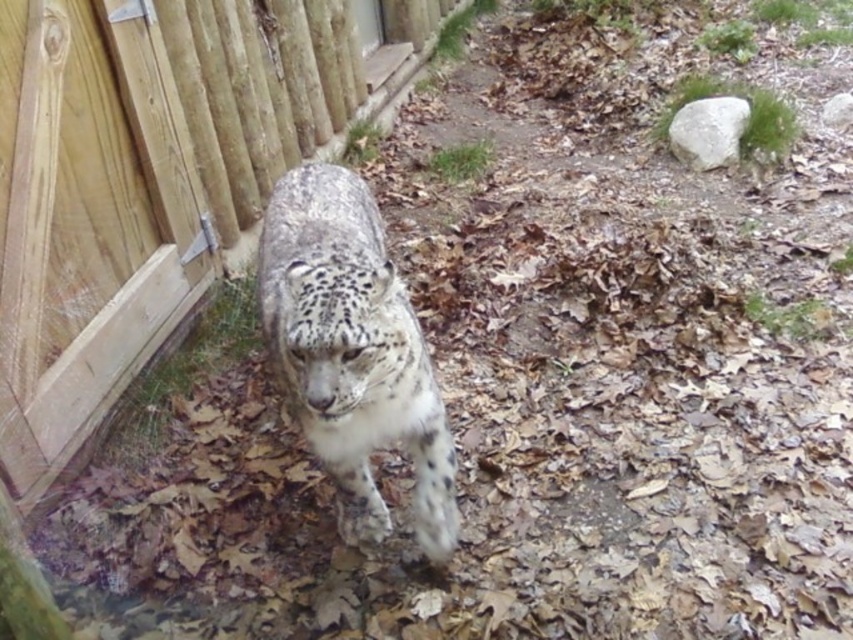
Between wooden fence at left and spotted fur snow leopard at center, which one appears on the left side from the viewer's perspective?

wooden fence at left

In the scene shown: Can you confirm if wooden fence at left is positioned above spotted fur snow leopard at center?

Yes.

Is point (252, 109) farther from viewer compared to point (403, 333)?

Yes, it is.

This screenshot has height=640, width=853. I want to click on wooden fence at left, so click(154, 180).